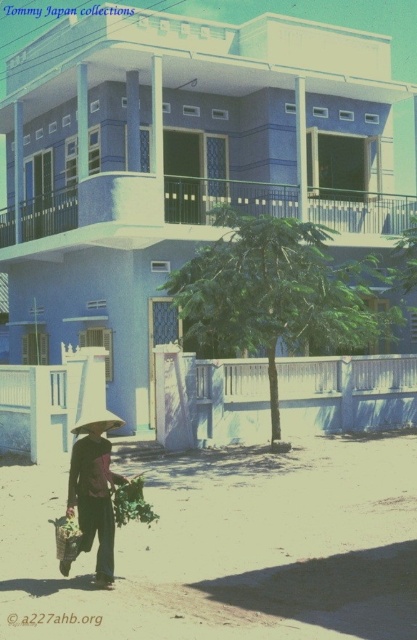
Question: Does brown woven basket at lower left come behind wooden woven basket at lower left?

Choices:
 (A) yes
 (B) no

Answer: (A)

Question: Which of the following is the closest to the observer?

Choices:
 (A) wooden woven basket at lower left
 (B) brown woven basket at lower left

Answer: (A)

Question: Which object is positioned farthest from the wooden woven basket at lower left?

Choices:
 (A) brown woven basket at lower left
 (B) green leafy plant at lower center

Answer: (B)

Question: Is the position of green leafy plant at lower center more distant than that of wooden woven basket at lower left?

Choices:
 (A) yes
 (B) no

Answer: (A)

Question: Which of the following is the farthest from the observer?

Choices:
 (A) (92, 484)
 (B) (80, 531)

Answer: (A)

Question: Does green leafy plant at lower center have a greater width compared to wooden woven basket at lower left?

Choices:
 (A) yes
 (B) no

Answer: (A)